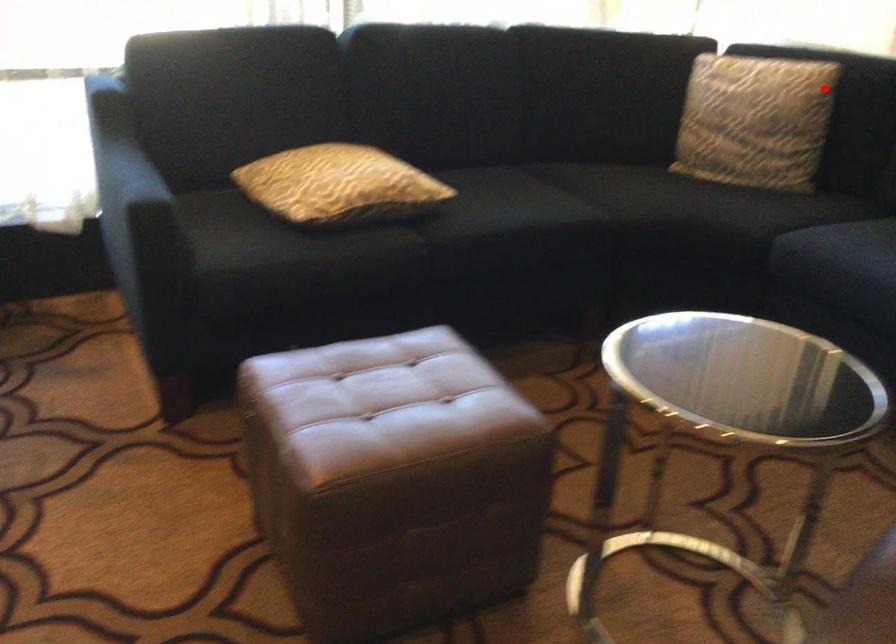
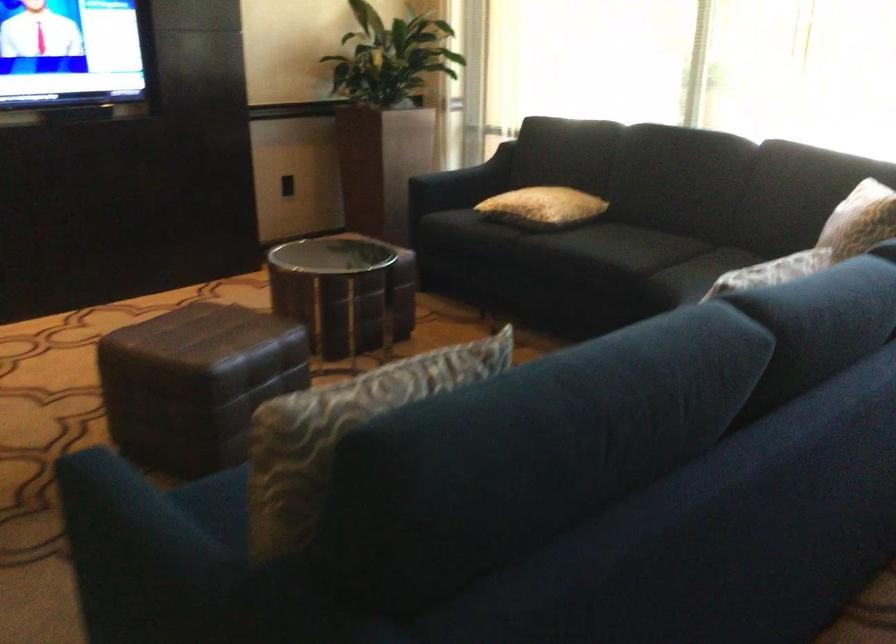
The point at the highlighted location is marked in the first image. Where is the corresponding point in the second image?

(859, 220)